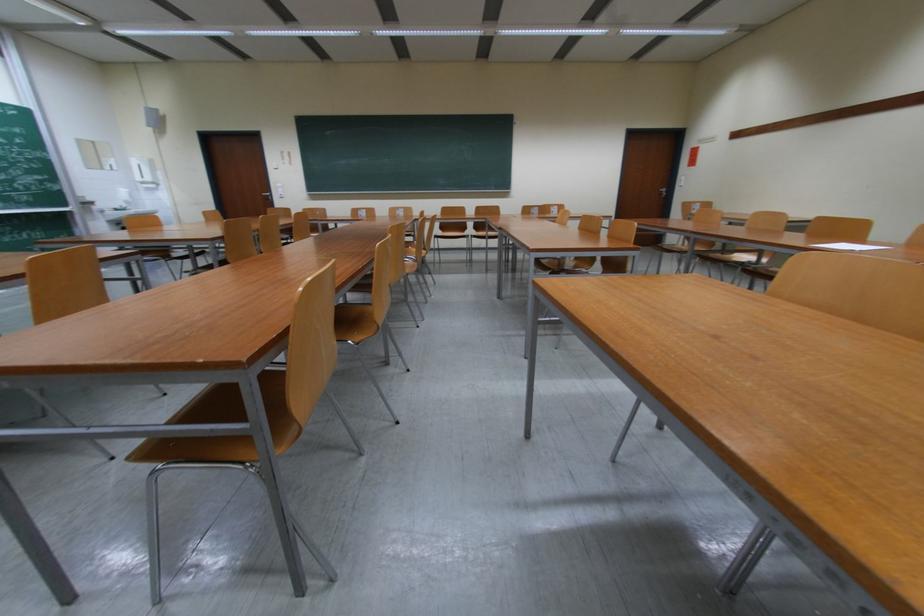
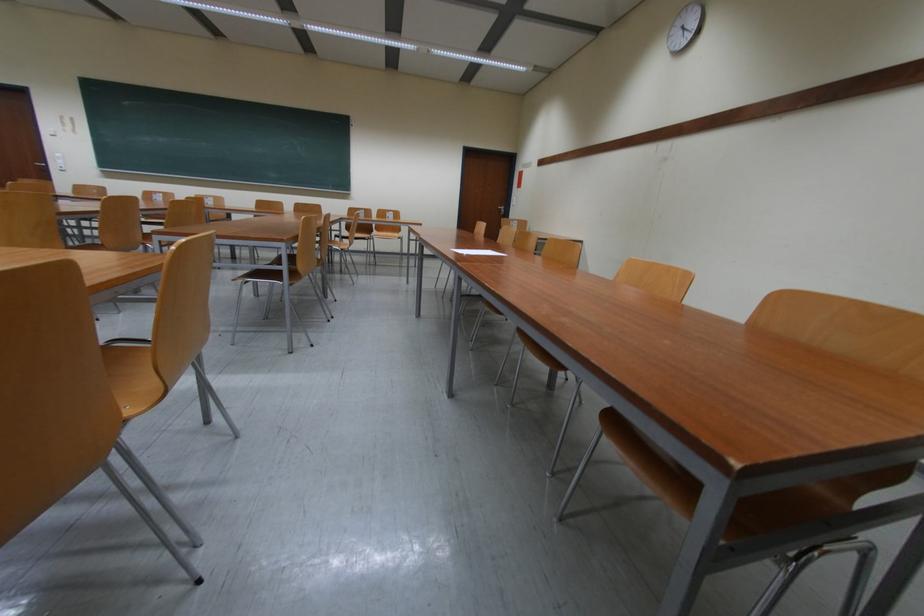
Question: What movement of the cameraman would produce the second image?

Choices:
 (A) Left
 (B) Right
 (C) Forward
 (D) Backward

Answer: (B)